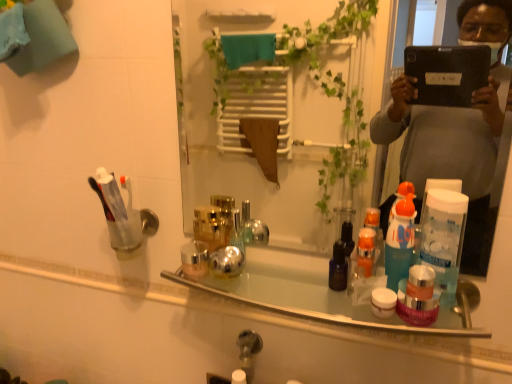
What is the approximate height of clear glass mirror at center?

The height of clear glass mirror at center is 20.46 inches.

This screenshot has width=512, height=384. In order to click on shiny metallic bottles at center in this screenshot , I will do `click(316, 294)`.

This screenshot has height=384, width=512. What do you see at coordinates (316, 294) in the screenshot? I see `shiny metallic bottles at center` at bounding box center [316, 294].

I want to click on clear glass mirror at center, so click(241, 146).

Does clear glass mirror at center have a greater width compared to clear plastic cup at left?

No, clear glass mirror at center is not wider than clear plastic cup at left.

From a real-world perspective, which object rests below the other?

clear plastic cup at left, from a real-world perspective.

Is clear plastic cup at left surrounded by clear glass mirror at center?

No, clear glass mirror at center does not contain clear plastic cup at left.

From the image's perspective, between clear glass mirror at center and clear plastic cup at left, who is located below?

clear plastic cup at left is shown below in the image.

Considering the relative sizes of shiny metallic bottles at center and clear plastic cup at left in the image provided, is shiny metallic bottles at center thinner than clear plastic cup at left?

No, shiny metallic bottles at center is not thinner than clear plastic cup at left.

Is shiny metallic bottles at center to the right of clear plastic cup at left from the viewer's perspective?

Yes, shiny metallic bottles at center is to the right of clear plastic cup at left.

Is shiny metallic bottles at center far from clear plastic cup at left?

No.

Measure the distance from shiny metallic bottles at center to clear plastic cup at left.

shiny metallic bottles at center and clear plastic cup at left are 12.34 inches apart.

Can you see clear plastic cup at left touching clear glass mirror at center?

No.

Would you say clear plastic cup at left is inside or outside clear glass mirror at center?

clear plastic cup at left is located beyond the bounds of clear glass mirror at center.

Is the depth of clear plastic cup at left greater than that of clear glass mirror at center?

Yes, it is behind clear glass mirror at center.

Is clear plastic cup at left at the left side of clear glass mirror at center?

Yes, clear plastic cup at left is to the left of clear glass mirror at center.

Is point (149, 228) closer to viewer compared to point (469, 322)?

No.

At what (x,y) coordinates should I click in order to perform the action: click on toiletry above the shiny metallic bottles at center (from the image's perspective). Please return your answer as a coordinate pair (x, y). Looking at the image, I should click on (122, 213).

What's the angular difference between clear plastic cup at left and shiny metallic bottles at center's facing directions?

The facing directions of clear plastic cup at left and shiny metallic bottles at center are 2.22 degrees apart.

From a real-world perspective, is clear plastic cup at left located higher than shiny metallic bottles at center?

Yes.

From a real-world perspective, relative to clear glass mirror at center, is shiny metallic bottles at center vertically above or below?

Clearly, from a real-world perspective, shiny metallic bottles at center is below clear glass mirror at center.

Which is in front, shiny metallic bottles at center or clear glass mirror at center?

Positioned in front is clear glass mirror at center.

Is shiny metallic bottles at center oriented away from clear glass mirror at center?

No, shiny metallic bottles at center is not facing the opposite direction of clear glass mirror at center.

From the picture: Is clear glass mirror at center directly adjacent to shiny metallic bottles at center?

clear glass mirror at center is not next to shiny metallic bottles at center, and they're not touching.

Identify the location of mirror located on the right of shiny metallic bottles at center. (241, 146).

Is clear glass mirror at center not inside shiny metallic bottles at center?

clear glass mirror at center lies outside shiny metallic bottles at center's area.

Between clear glass mirror at center and shiny metallic bottles at center, which one has more height?

clear glass mirror at center is taller.

Locate an element on the screen. Image resolution: width=512 pixels, height=384 pixels. mirror lying on the right of clear plastic cup at left is located at coordinates (241, 146).

The image size is (512, 384). What are the coordinates of `toiletry that appears on the left of shiny metallic bottles at center` in the screenshot? It's located at (122, 213).

Consider the image. Considering their positions, is clear plastic cup at left positioned further to clear glass mirror at center than shiny metallic bottles at center?

shiny metallic bottles at center lies further to clear glass mirror at center than the other object.

Looking at the image, which one is located further to shiny metallic bottles at center, clear plastic cup at left or clear glass mirror at center?

clear glass mirror at center is further to shiny metallic bottles at center.

From the image, which object appears to be nearer to shiny metallic bottles at center, clear glass mirror at center or clear plastic cup at left?

Based on the image, clear plastic cup at left appears to be nearer to shiny metallic bottles at center.

Estimate the real-world distances between objects in this image. Which object is further from clear plastic cup at left, clear glass mirror at center or shiny metallic bottles at center?

The object further to clear plastic cup at left is clear glass mirror at center.

Estimate the real-world distances between objects in this image. Which object is further from clear plastic cup at left, shiny metallic bottles at center or clear glass mirror at center?

clear glass mirror at center is positioned further to the anchor clear plastic cup at left.

From the image, which object appears to be farther from clear glass mirror at center, shiny metallic bottles at center or clear plastic cup at left?

Based on the image, shiny metallic bottles at center appears to be further to clear glass mirror at center.

Where is `bath between clear plastic cup at left and clear glass mirror at center in the horizontal direction`? Image resolution: width=512 pixels, height=384 pixels. bath between clear plastic cup at left and clear glass mirror at center in the horizontal direction is located at coordinates (316, 294).